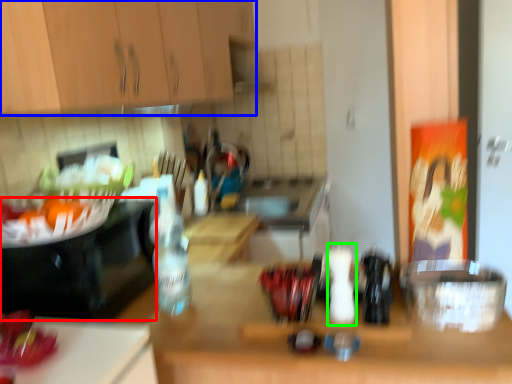
Question: Which is nearer to the appliance (highlighted by a red box)? cabinetry (highlighted by a blue box) or bottle (highlighted by a green box).

Choices:
 (A) cabinetry
 (B) bottle

Answer: (A)